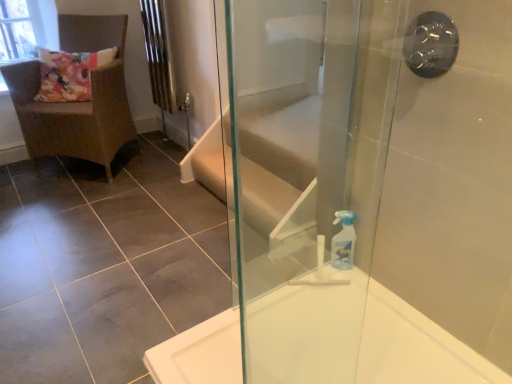
Question: Based on their positions, is transparent glass window screen at upper left located to the left or right of brown woven chair at upper left?

Choices:
 (A) right
 (B) left

Answer: (B)

Question: Considering the positions of transparent glass window screen at upper left and brown woven chair at upper left in the image, is transparent glass window screen at upper left wider or thinner than brown woven chair at upper left?

Choices:
 (A) wide
 (B) thin

Answer: (B)

Question: Based on their relative distances, which object is farther from the brown woven chair at upper left?

Choices:
 (A) black metallic shower handle at upper right
 (B) transparent glass window screen at upper left
 (C) transparent plastic spray bottle at right
 (D) transparent glass screen door at right
 (E) white glossy bathtub at lower right

Answer: (A)

Question: Estimate the real-world distances between objects in this image. Which object is closer to the transparent glass window screen at upper left?

Choices:
 (A) black metallic shower handle at upper right
 (B) brown woven chair at upper left
 (C) transparent glass screen door at right
 (D) transparent plastic spray bottle at right
 (E) white glossy bathtub at lower right

Answer: (B)